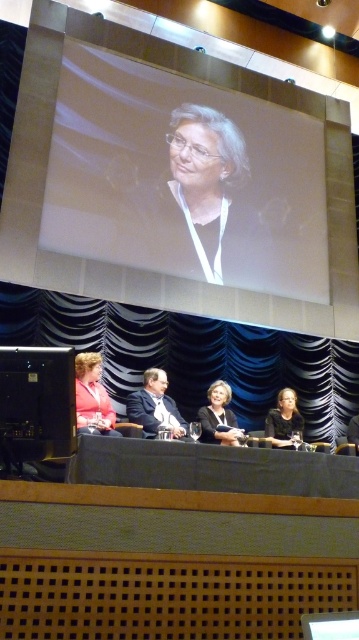
You are a photographer at the event and need to capture a photo that includes both the matte black jacket at center and the matte black hair at lower right. What is the minimum distance you need to keep between the camera and the stage to ensure both objects are in frame?

The minimum distance required is such that the camera can capture both the matte black jacket at center and the matte black hair at lower right, which are 21.01 inches apart, within the frame.

You are a photographer adjusting your camera to capture the stage setup. You notice two points marked on your viewfinder at coordinates point (103, 392) and point (221, 385). Which point should you focus on first if you want to ensure the closest object in the scene is sharply focused?

Point (103, 392) is closer to the camera than point (221, 385), so you should focus on point (103, 392) first to ensure the closest object is sharply focused.

You are attending this event and want to take a photo of the speaker wearing the matte pink shirt at lower left and the person in matte black jacket at center. Since you want both to be in focus, you need to know which one is closer to you. Can you determine which one is closer based on their sizes?

The matte pink shirt at lower left is taller than the matte black jacket at center, which means the person wearing the matte pink shirt at lower left is closer to you.